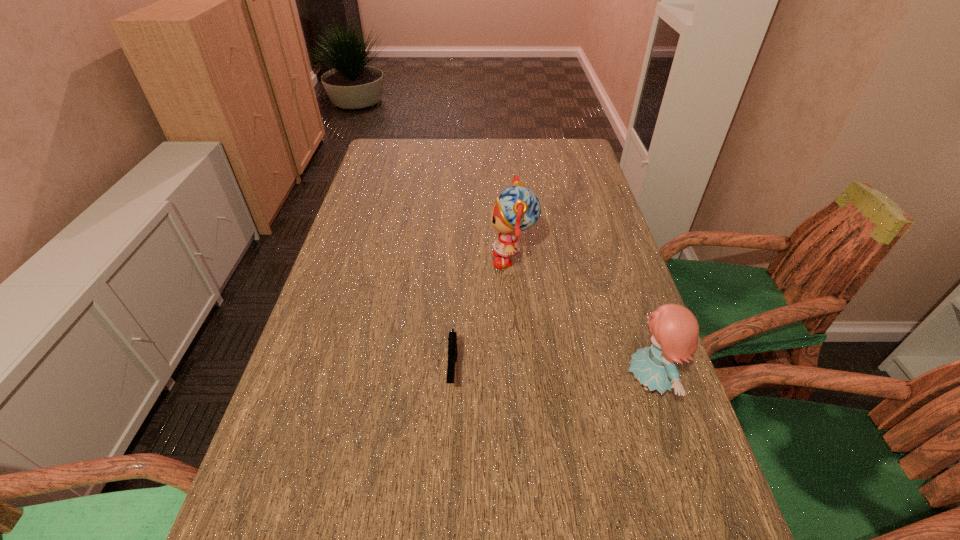
You are a GUI agent. You are given a task and a screenshot of the screen. Output one action in this format:
    pyautogui.click(x=<x>, y=<y>)
    Task: Click on the free space located on the front-facing side of the right doll
    This screenshot has height=540, width=960.
    Given the screenshot: What is the action you would take?
    pyautogui.click(x=531, y=383)

Find the location of a particular element. Image resolution: width=960 pixels, height=540 pixels. vacant area situated on the front-facing side of the right doll is located at coordinates (589, 383).

Locate an element on the screen. The width and height of the screenshot is (960, 540). vacant region located 0.070m on the front-facing side of the leftmost object is located at coordinates click(x=449, y=434).

You are a GUI agent. You are given a task and a screenshot of the screen. Output one action in this format:
    pyautogui.click(x=<x>, y=<y>)
    Task: Click on the object that is at the right edge
    The image size is (960, 540).
    Given the screenshot: What is the action you would take?
    pyautogui.click(x=675, y=330)

In the image, there is a desktop. Where is `vacant space at the far edge`? This screenshot has height=540, width=960. vacant space at the far edge is located at coordinates (527, 169).

In the image, there is a desktop. What are the coordinates of `vacant region at the left edge` in the screenshot? It's located at (350, 226).

Where is `vacant position at the right edge of the desktop`? This screenshot has width=960, height=540. vacant position at the right edge of the desktop is located at coordinates (572, 221).

Identify the location of unoccupied area between the leftmost object and the right doll. (551, 377).

I want to click on vacant point located between the shortest object and the rightmost object, so click(x=551, y=377).

In order to click on blank region between the farther doll and the right doll in this screenshot , I will do `click(581, 321)`.